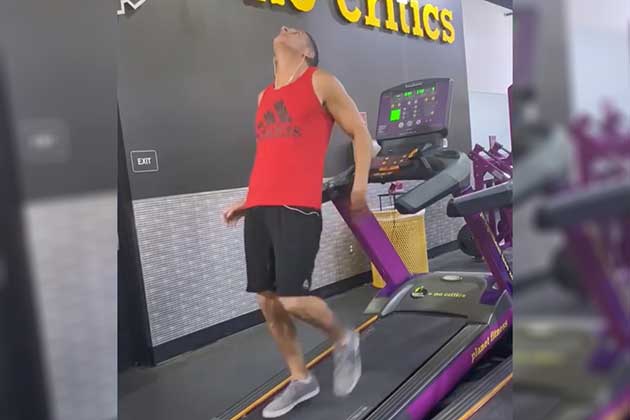
Find the location of a particular element. electronics is located at coordinates (408, 106).